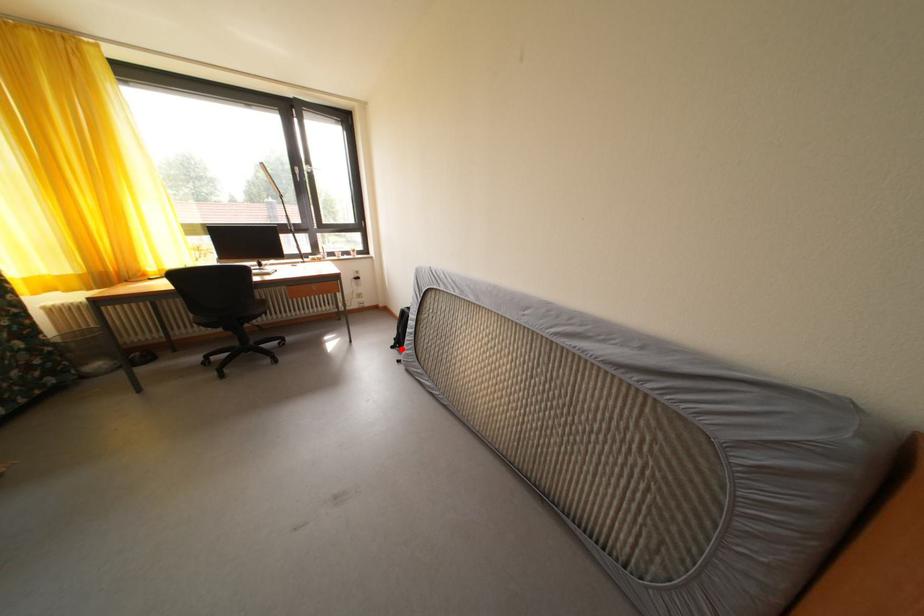
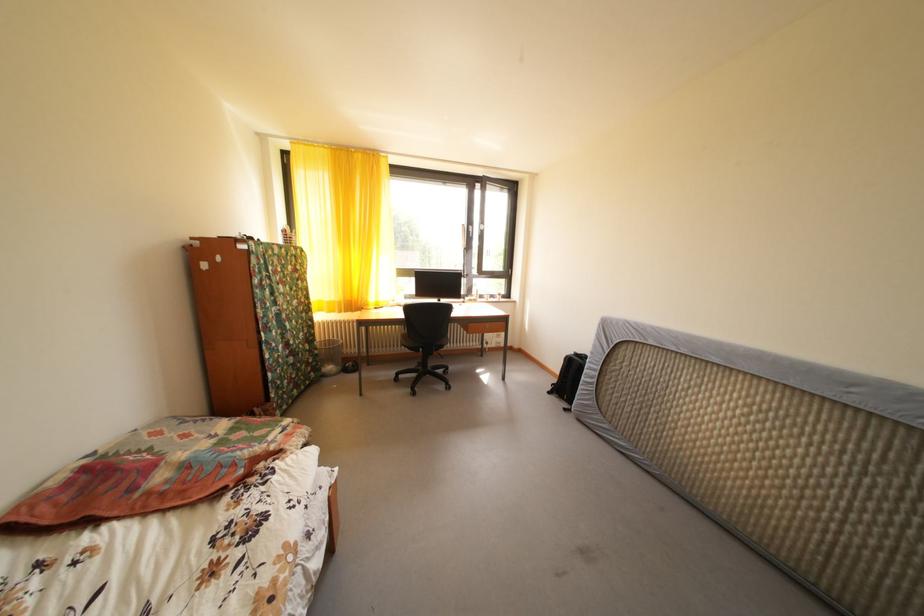
Find the pixel in the second image that matches the highlighted location in the first image.

(558, 394)